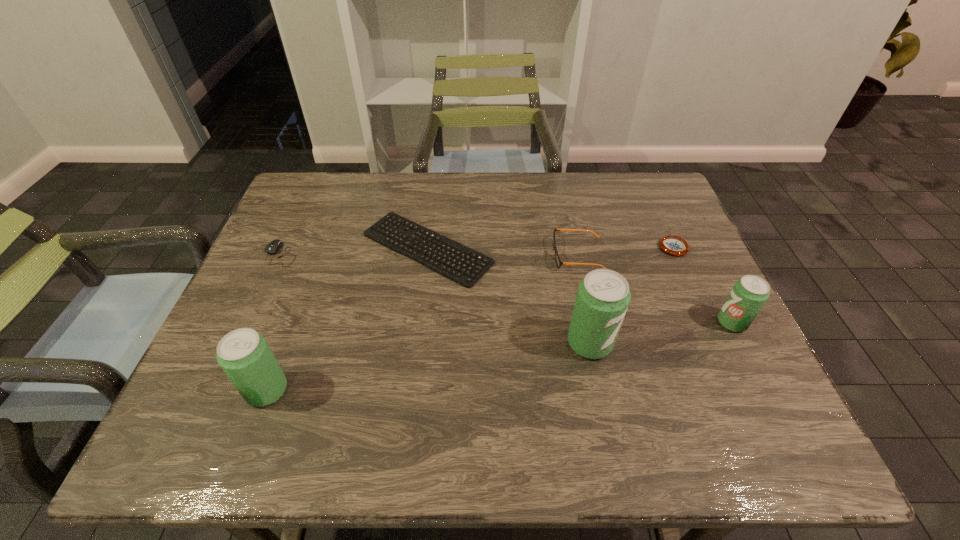
Find the location of a particular element. The width and height of the screenshot is (960, 540). free space at the far right corner of the desktop is located at coordinates (664, 184).

You are a GUI agent. You are given a task and a screenshot of the screen. Output one action in this format:
    pyautogui.click(x=<x>, y=<y>)
    Task: Click on the free spot between the compass and the fourth tallest object
    The image size is (960, 540).
    Given the screenshot: What is the action you would take?
    pyautogui.click(x=626, y=251)

The image size is (960, 540). I want to click on blank region between the sixth shortest object and the leftmost object, so click(275, 322).

Locate an element on the screen. The height and width of the screenshot is (540, 960). empty space between the second shortest soda and the shortest object is located at coordinates (348, 319).

Find the location of a particular element. The height and width of the screenshot is (540, 960). unoccupied area between the fourth shortest object and the compass is located at coordinates (626, 251).

Where is `free space between the compass and the second shortest soda`? Image resolution: width=960 pixels, height=540 pixels. free space between the compass and the second shortest soda is located at coordinates (470, 318).

Find the location of a particular element. free space between the fourth tallest object and the compass is located at coordinates (626, 251).

What are the coordinates of `free area in between the tallest soda and the leftmost object` in the screenshot? It's located at (436, 299).

This screenshot has width=960, height=540. I want to click on free space between the compass and the spectacles, so click(626, 251).

Locate an element on the screen. Image resolution: width=960 pixels, height=540 pixels. vacant area that lies between the compass and the spectacles is located at coordinates (626, 251).